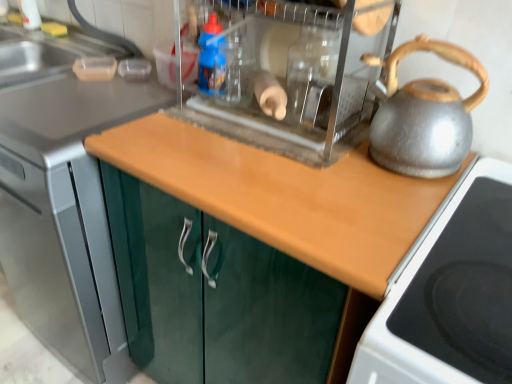
The width and height of the screenshot is (512, 384). What are the coordinates of `empty space that is ontop of wooden at center, the first countertop when ordered from right to left (from a real-world perspective)` in the screenshot? It's located at (274, 162).